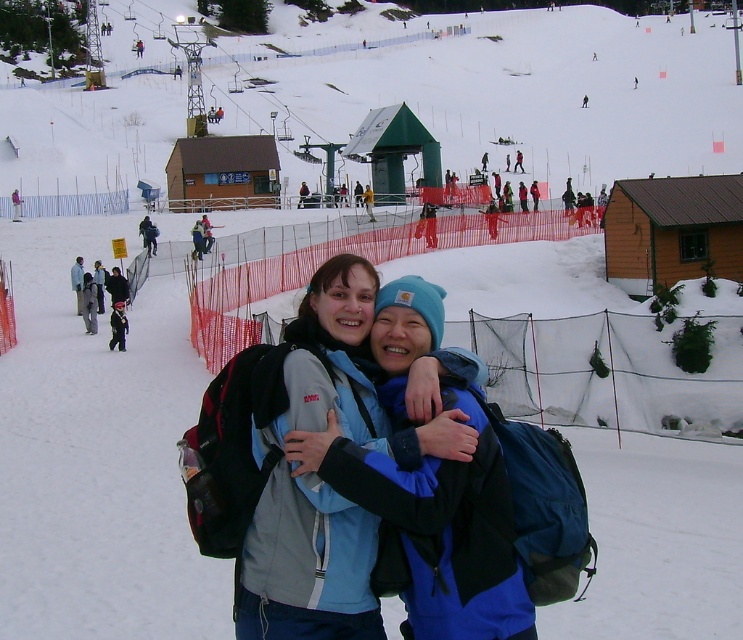
Does blue fabric jacket at center have a lesser width compared to dark blue jacket at center?

In fact, blue fabric jacket at center might be wider than dark blue jacket at center.

Is blue fabric jacket at center bigger than dark blue jacket at center?

Yes, blue fabric jacket at center is bigger than dark blue jacket at center.

Measure the distance between point (418, 390) and camera.

A distance of 7.27 meters exists between point (418, 390) and camera.

Locate an element on the screen. This screenshot has height=640, width=743. blue fabric jacket at center is located at coordinates (311, 474).